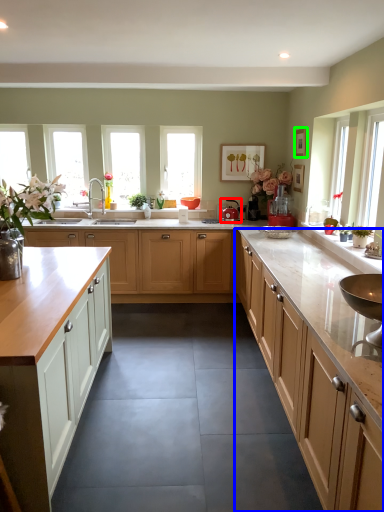
Question: Considering the real-world distances, which object is farthest from appliance (highlighted by a red box)? cabinetry (highlighted by a blue box) or picture frame (highlighted by a green box)?

Choices:
 (A) cabinetry
 (B) picture frame

Answer: (A)